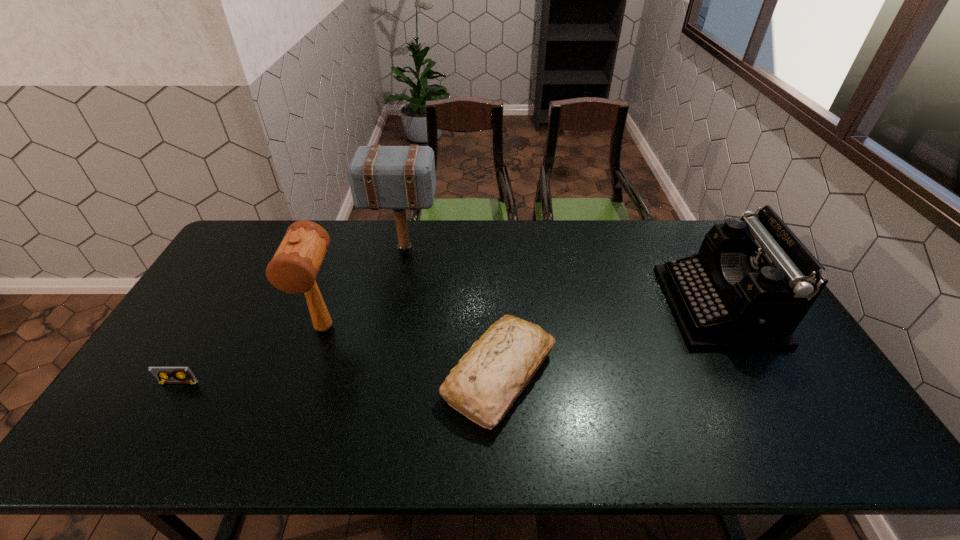
This screenshot has width=960, height=540. In order to click on vacant space that satisfies the following two spatial constraints: 1. on the striking surface of the right mallet; 2. at the front of the videotape with visible reels in this screenshot , I will do `click(378, 383)`.

What are the coordinates of `vacant space that satisfies the following two spatial constraints: 1. on the striking surface of the fourth tallest object; 2. on the left side of the farther mallet` in the screenshot? It's located at (379, 375).